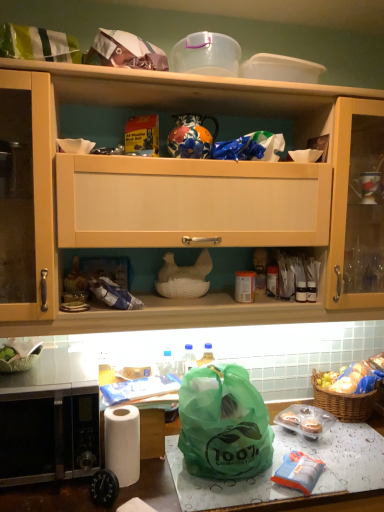
The width and height of the screenshot is (384, 512). In order to click on vacant position to the left of white matte paper towel at lower left in this screenshot , I will do pos(56,498).